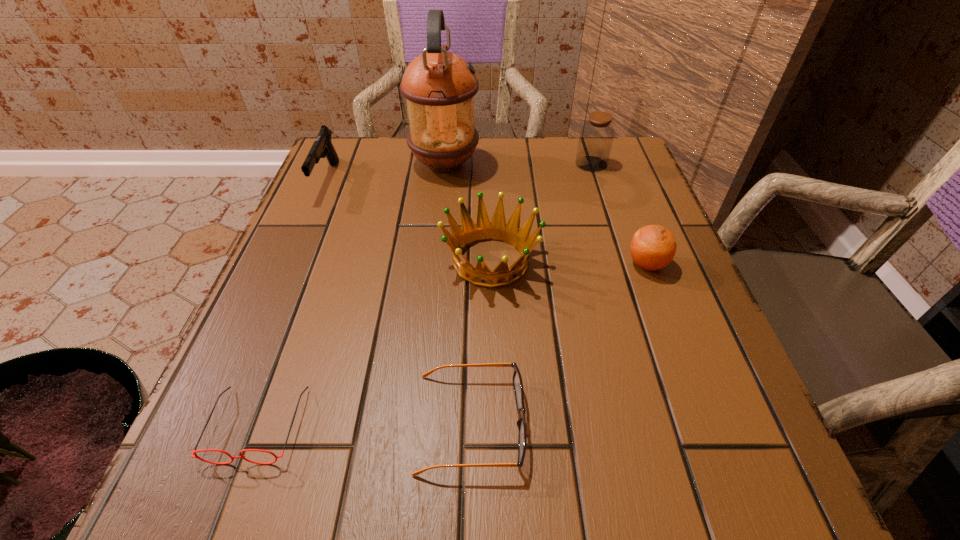
Find the location of a particular element. This screenshot has width=960, height=540. free space located 0.210m on the back of the crown is located at coordinates (489, 173).

Locate an element on the screen. The height and width of the screenshot is (540, 960). free spot located on the front of the orange is located at coordinates (691, 383).

You are a GUI agent. You are given a task and a screenshot of the screen. Output one action in this format:
    pyautogui.click(x=<x>, y=<y>)
    Task: Click on the vacant space located 0.120m on the front-facing side of the right spectacles
    This screenshot has width=960, height=540.
    Given the screenshot: What is the action you would take?
    pyautogui.click(x=608, y=423)

Locate an element on the screen. This screenshot has width=960, height=540. oil lamp positioned at the far edge is located at coordinates (439, 86).

Where is `jar positioned at the far edge`? The height and width of the screenshot is (540, 960). jar positioned at the far edge is located at coordinates (596, 137).

Image resolution: width=960 pixels, height=540 pixels. I want to click on gun that is positioned at the far edge, so click(x=322, y=147).

Identify the location of gun that is at the left edge. This screenshot has height=540, width=960. (322, 147).

What are the coordinates of `spectacles that is positioned at the left edge` in the screenshot? It's located at (194, 452).

I want to click on jar at the right edge, so click(596, 137).

The height and width of the screenshot is (540, 960). Find the location of `orange at the right edge`. orange at the right edge is located at coordinates (653, 247).